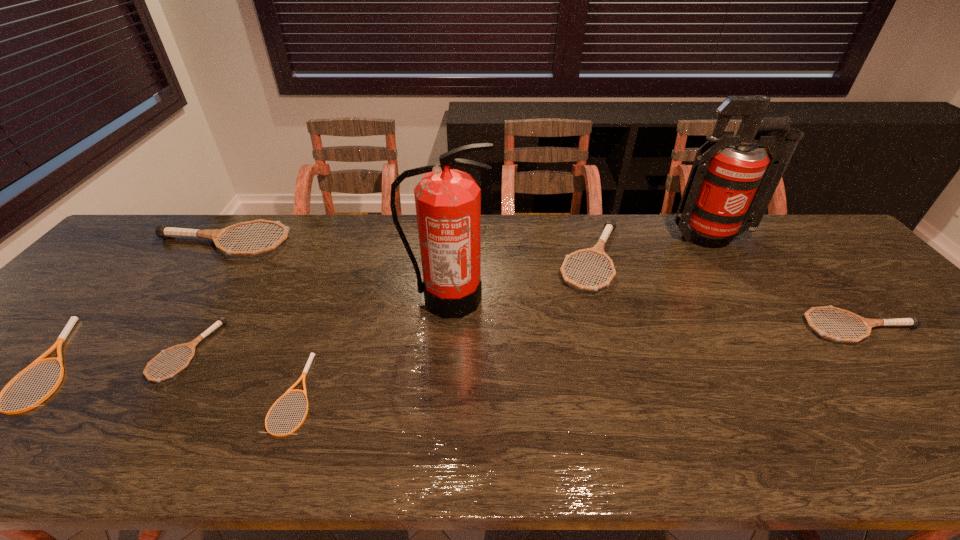
The height and width of the screenshot is (540, 960). Identify the location of the fourth tallest tennis racket. (191, 345).

Locate an element on the screen. This screenshot has width=960, height=540. the sixth tallest object is located at coordinates (191, 345).

Locate an element on the screen. This screenshot has width=960, height=540. the fifth object from right to left is located at coordinates (308, 364).

This screenshot has height=540, width=960. I want to click on the smaller beige tennis racket, so click(308, 364).

The height and width of the screenshot is (540, 960). Identify the location of vacant space situated 0.200m on the front label side of the red fire extinguisher. (753, 299).

Image resolution: width=960 pixels, height=540 pixels. Identify the location of free space located on the front side of the fourth object from right to left. (443, 359).

Find the location of a particular element. This screenshot has width=960, height=540. free space located on the front of the tallest tennis racket is located at coordinates (130, 371).

Where is `free region located on the back of the fourth tallest object`? free region located on the back of the fourth tallest object is located at coordinates (578, 214).

The image size is (960, 540). Find the location of `vacant region located on the back of the fifth tallest object`. vacant region located on the back of the fifth tallest object is located at coordinates (833, 297).

Locate an element on the screen. vacant region located 0.340m on the right of the third shortest object is located at coordinates (355, 351).